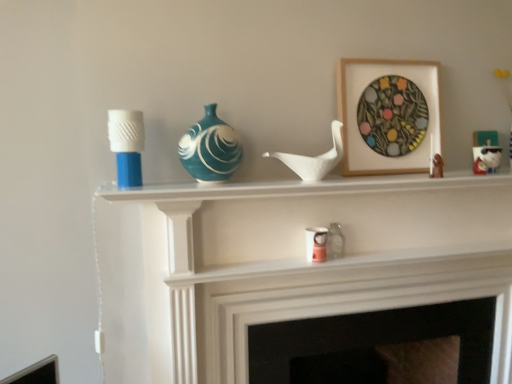
Where is `vacant region below white matte bird at center, the 3th toy when ordered from back to front (from a real-world perspective)`? This screenshot has width=512, height=384. vacant region below white matte bird at center, the 3th toy when ordered from back to front (from a real-world perspective) is located at coordinates (297, 185).